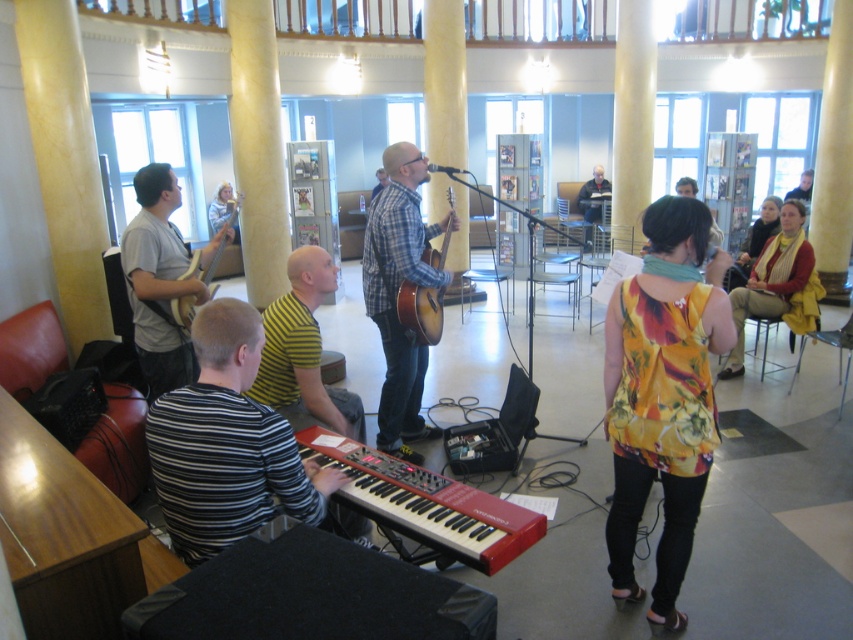
Question: Can you confirm if striped fabric keyboard at lower left is positioned below yellow scarf at right?

Choices:
 (A) no
 (B) yes

Answer: (B)

Question: Considering the relative positions of floral print blouse at center and striped shirt at center in the image provided, where is floral print blouse at center located with respect to striped shirt at center?

Choices:
 (A) right
 (B) left

Answer: (A)

Question: Does matte gray guitar at left appear on the left side of matte wood guitar at left?

Choices:
 (A) yes
 (B) no

Answer: (A)

Question: Estimate the real-world distances between objects in this image. Which object is farther from the striped fabric keyboard at lower left?

Choices:
 (A) yellow striped shirt at center
 (B) matte gray guitar at left

Answer: (B)

Question: Which point is farther to the camera?

Choices:
 (A) (218, 196)
 (B) (439, 268)

Answer: (A)

Question: Which point appears farthest from the camera in this image?

Choices:
 (A) (775, 246)
 (B) (294, 406)
 (C) (201, 262)

Answer: (A)